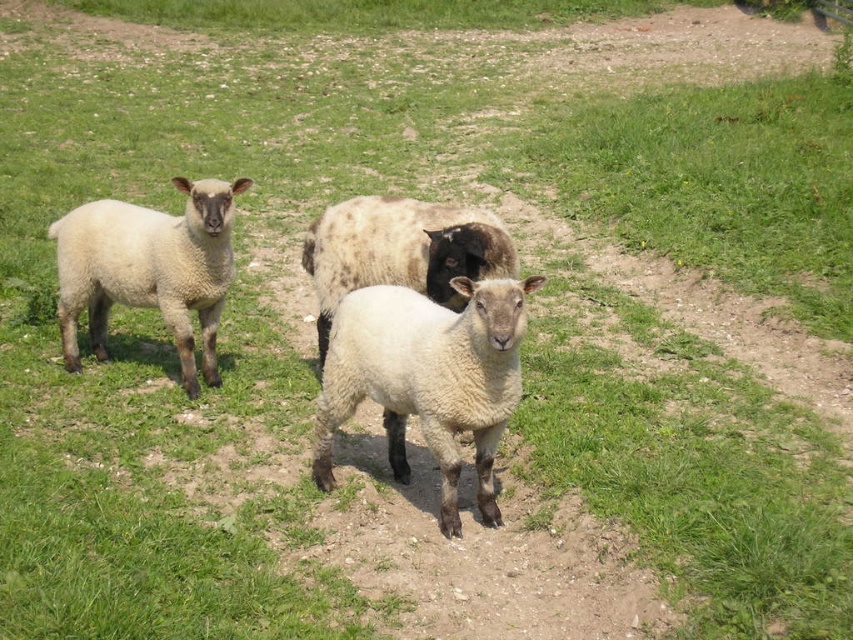
Is point (78, 368) behind point (318, 288)?

Yes, point (78, 368) is behind point (318, 288).

Between white woolly lamb at left and white woolen sheep at center, which one has more height?

white woolly lamb at left

At what (x,y) coordinates should I click in order to perform the action: click on white woolly lamb at left. Please return your answer as a coordinate pair (x, y). The width and height of the screenshot is (853, 640). Looking at the image, I should click on (148, 269).

Can you confirm if white woolen lamb at center is positioned to the right of white woolen sheep at center?

Indeed, white woolen lamb at center is positioned on the right side of white woolen sheep at center.

Does white woolen lamb at center have a larger size compared to white woolen sheep at center?

Actually, white woolen lamb at center might be smaller than white woolen sheep at center.

Who is more forward, [466,368] or [450,296]?

Point [466,368] is more forward.

Identify the location of white woolen lamb at center. (427, 378).

Is white woolen lamb at center further to the viewer compared to white woolly lamb at left?

No, it is in front of white woolly lamb at left.

Between white woolen lamb at center and white woolly lamb at left, which one appears on the right side from the viewer's perspective?

white woolen lamb at center is more to the right.

Between point (412, 333) and point (79, 307), which one is positioned behind?

The point (79, 307) is behind.

Locate an element on the screen. This screenshot has width=853, height=640. white woolen lamb at center is located at coordinates (427, 378).